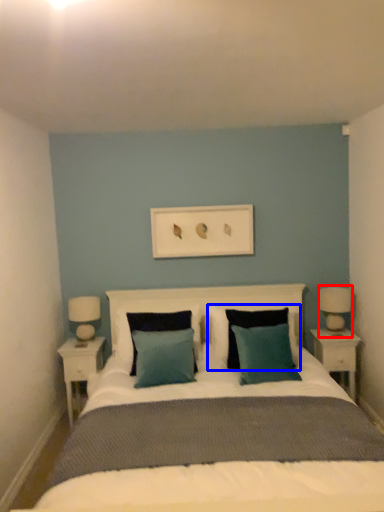
Question: Which point is closer to the camera, bedside lamp (highlighted by a red box) or pillow (highlighted by a blue box)?

Choices:
 (A) bedside lamp
 (B) pillow

Answer: (B)